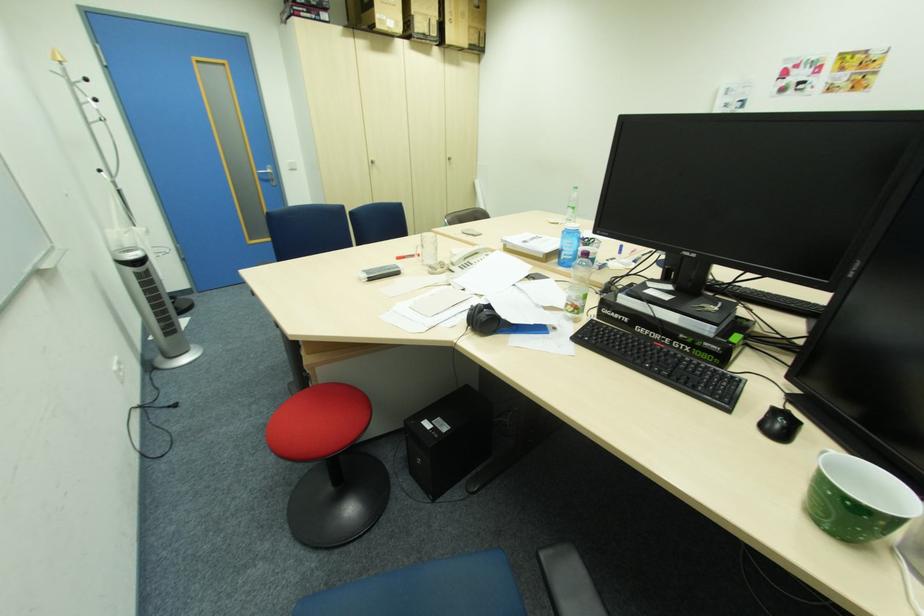
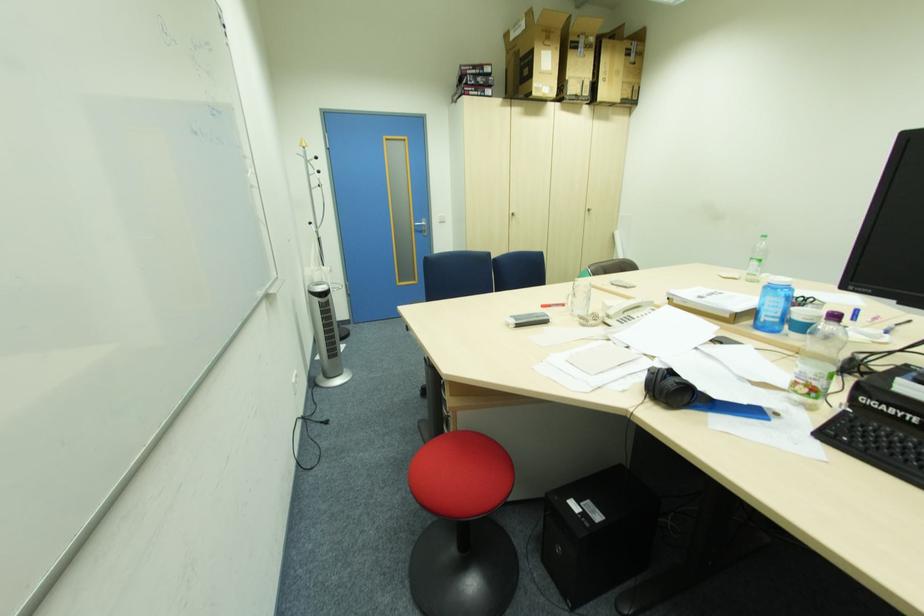
Which direction would the cameraman need to move to produce the second image?

The movement direction of the cameraman is left, forward.